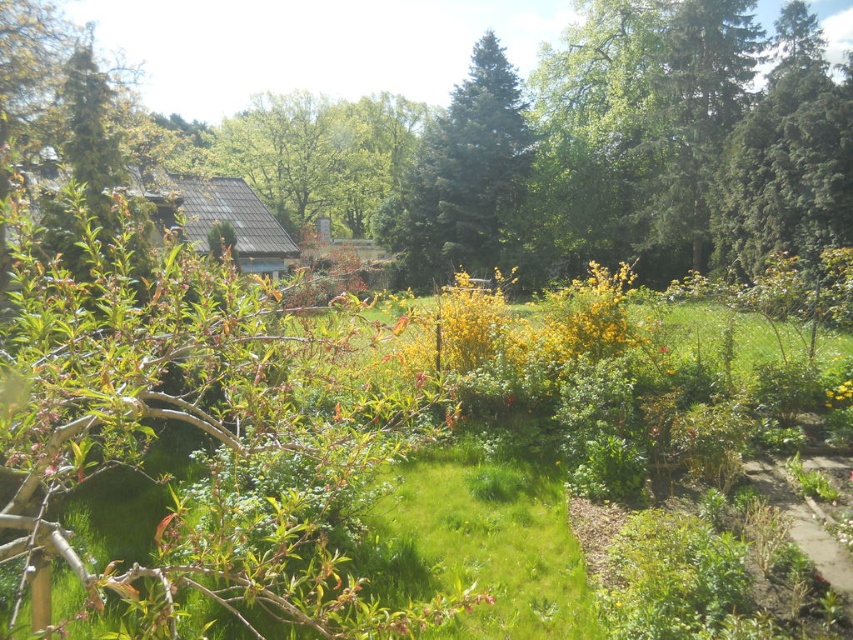
Which is below, green grass at center or green textured pine tree at center?

green grass at center

Who is taller, green grass at center or green textured pine tree at center?

Standing taller between the two is green textured pine tree at center.

At what (x,y) coordinates should I click in order to perform the action: click on green grass at center. Please return your answer as a coordinate pair (x, y). This screenshot has height=640, width=853. Looking at the image, I should click on (219, 449).

Image resolution: width=853 pixels, height=640 pixels. I want to click on green grass at center, so click(219, 449).

Between green grass at center and yellow matte flower at lower right, which one is positioned lower?

yellow matte flower at lower right is below.

Who is more distant from viewer, (154, 632) or (846, 378)?

The point (846, 378) is behind.

Image resolution: width=853 pixels, height=640 pixels. I want to click on green grass at center, so click(x=219, y=449).

Measure the distance from green textured tree at upper right to yellow matte flower at lower right.

green textured tree at upper right is 61.67 feet from yellow matte flower at lower right.

Between point (804, 211) and point (851, 396), which one is positioned behind?

Point (804, 211)

Where is `green textured tree at upper right`? green textured tree at upper right is located at coordinates (787, 157).

In order to click on green textured tree at upper right in this screenshot , I will do `click(787, 157)`.